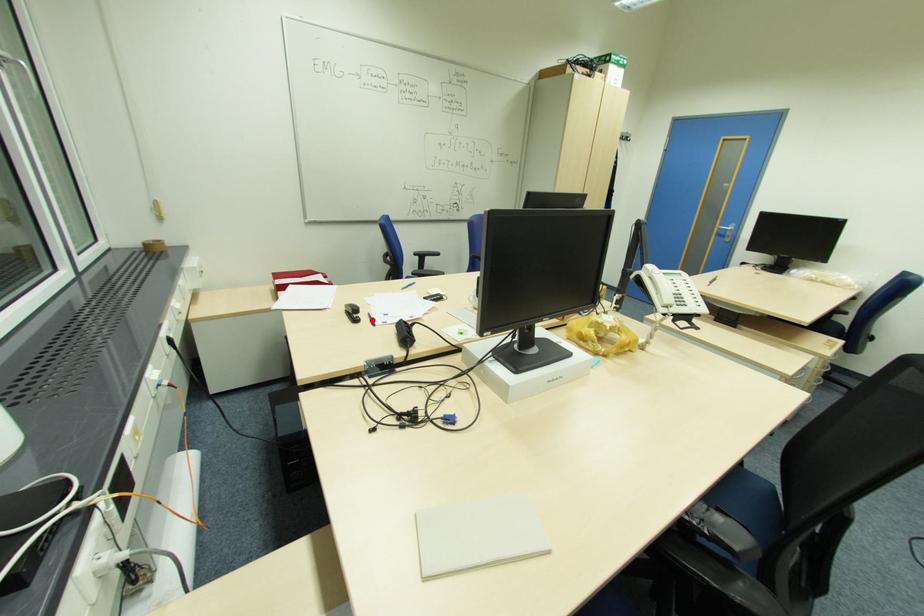
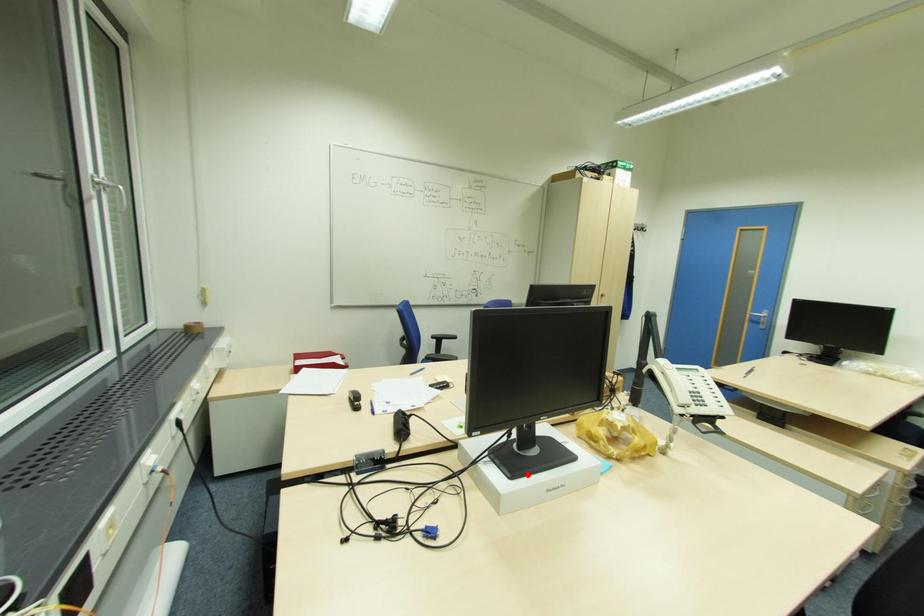
I am providing you with two images of the same scene from different viewpoints. A red point is marked on the first image and another point is marked on the second image. Is the red point in image1 aligned with the point shown in image2?

No